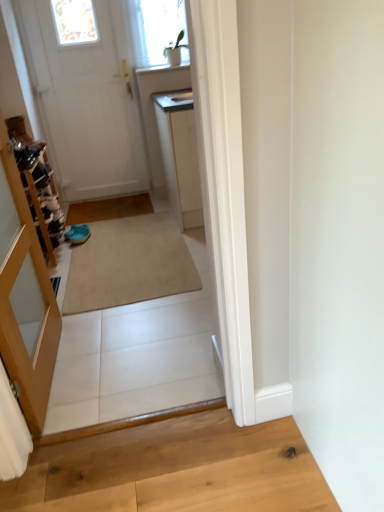
This screenshot has height=512, width=384. What do you see at coordinates (132, 350) in the screenshot?
I see `beige carpet at center` at bounding box center [132, 350].

The height and width of the screenshot is (512, 384). Find the location of `beige carpet at center`. beige carpet at center is located at coordinates (132, 350).

What do you see at coordinates (176, 470) in the screenshot?
I see `light brown wood at lower right` at bounding box center [176, 470].

Image resolution: width=384 pixels, height=512 pixels. Identify the location of beige carpet at center. (132, 350).

Between beige carpet at center and light brown wood at lower right, which one appears on the left side from the viewer's perspective?

From the viewer's perspective, beige carpet at center appears more on the left side.

Is beige carpet at center positioned in front of light brown wood at lower right?

No, it is not.

Is beige carpet at center facing towards light brown wood at lower right?

Yes, beige carpet at center is turned towards light brown wood at lower right.

From the image's perspective, would you say light brown wood at lower right is positioned over beige carpet at center?

No, from the image's perspective, light brown wood at lower right is not above beige carpet at center.

Is point (97, 458) closer to camera compared to point (149, 339)?

That is True.

Considering their positions, is light brown wood at lower right located in front of or behind beige carpet at center?

light brown wood at lower right is in front of beige carpet at center.

Is light brown wood at lower right completely or partially outside of beige carpet at center?

Yes.

What's the angular difference between white matte door at upper left and light brown wood at lower right's facing directions?

The facing directions of white matte door at upper left and light brown wood at lower right are 1.33 degrees apart.

Can you confirm if white matte door at upper left is shorter than light brown wood at lower right?

In fact, white matte door at upper left may be taller than light brown wood at lower right.

Is white matte door at upper left looking in the opposite direction of light brown wood at lower right?

white matte door at upper left does not have its back to light brown wood at lower right.

Which is in front, white matte door at upper left or light brown wood at lower right?

light brown wood at lower right.

In the scene shown: From the image's perspective, between white matte door at upper left and beige carpet at center, which one is located above?

white matte door at upper left is shown above in the image.

Does white matte door at upper left have a larger size compared to beige carpet at center?

Actually, white matte door at upper left might be smaller than beige carpet at center.

Image resolution: width=384 pixels, height=512 pixels. Identify the location of door lying on the left of beige carpet at center. (86, 106).

Is white matte door at upper left wider or thinner than beige carpet at center?

Clearly, white matte door at upper left has less width compared to beige carpet at center.

Based on the photo, would you say beige carpet at center is a long distance from white matte door at upper left?

Absolutely, beige carpet at center is distant from white matte door at upper left.

Considering the relative sizes of beige carpet at center and white matte door at upper left in the image provided, is beige carpet at center smaller than white matte door at upper left?

No, beige carpet at center is not smaller than white matte door at upper left.

From a real-world perspective, between beige carpet at center and white matte door at upper left, who is vertically lower?

beige carpet at center is physically lower.

This screenshot has width=384, height=512. What are the coordinates of `hardwood below the white matte door at upper left (from the image's perspective)` in the screenshot? It's located at (176, 470).

From a real-world perspective, which is physically above, light brown wood at lower right or white matte door at upper left?

white matte door at upper left is physically above.

Considering the sizes of light brown wood at lower right and white matte door at upper left in the image, is light brown wood at lower right taller or shorter than white matte door at upper left?

In the image, light brown wood at lower right appears to be shorter than white matte door at upper left.

Locate an element on the screen. Image resolution: width=384 pixels, height=512 pixels. path that is above the light brown wood at lower right (from the image's perspective) is located at coordinates (132, 350).

This screenshot has width=384, height=512. What are the coordinates of `path on the left of light brown wood at lower right` in the screenshot? It's located at (132, 350).

Considering their positions, is beige carpet at center positioned closer to light brown wood at lower right than white matte door at upper left?

beige carpet at center is closer to light brown wood at lower right.

Estimate the real-world distances between objects in this image. Which object is closer to light brown wood at lower right, white matte door at upper left or beige carpet at center?

The object closer to light brown wood at lower right is beige carpet at center.

Which object lies further to the anchor point white matte door at upper left, beige carpet at center or light brown wood at lower right?

light brown wood at lower right.

Which object lies nearer to the anchor point beige carpet at center, white matte door at upper left or light brown wood at lower right?

Among the two, light brown wood at lower right is located nearer to beige carpet at center.

Which object lies further to the anchor point beige carpet at center, light brown wood at lower right or white matte door at upper left?

Based on the image, white matte door at upper left appears to be further to beige carpet at center.

When comparing their distances from white matte door at upper left, does light brown wood at lower right or beige carpet at center seem closer?

beige carpet at center.

Identify the location of path between light brown wood at lower right and white matte door at upper left in the front-back direction. The width and height of the screenshot is (384, 512). (132, 350).